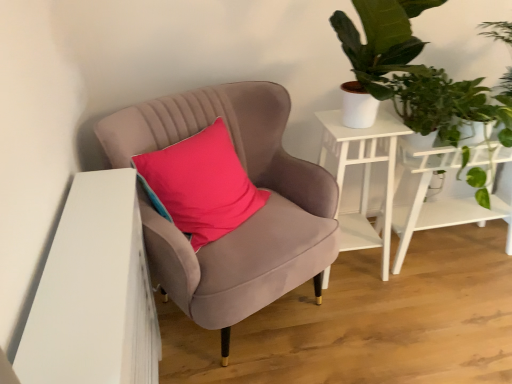
Question: Is white wood side table at upper right, the second table viewed from the right, turned away from green leafy plant at upper right?

Choices:
 (A) no
 (B) yes

Answer: (A)

Question: Considering the relative positions of white wood side table at upper right, arranged as the 1th table when viewed from the left, and green leafy plant at upper right in the image provided, is white wood side table at upper right, arranged as the 1th table when viewed from the left, behind green leafy plant at upper right?

Choices:
 (A) no
 (B) yes

Answer: (B)

Question: From a real-world perspective, is white wood side table at upper right, arranged as the 1th table when viewed from the left, below green leafy plant at upper right?

Choices:
 (A) no
 (B) yes

Answer: (B)

Question: Can you confirm if white wood side table at upper right, the second table viewed from the right, is positioned to the right of green leafy plant at upper right?

Choices:
 (A) no
 (B) yes

Answer: (A)

Question: Can you confirm if white wood side table at upper right, arranged as the 1th table when viewed from the left, is smaller than green leafy plant at upper right?

Choices:
 (A) yes
 (B) no

Answer: (B)

Question: Is velvet pink chair at center to the left or to the right of white matte table at right, positioned as the second table in left-to-right order, in the image?

Choices:
 (A) right
 (B) left

Answer: (B)

Question: From a real-world perspective, is velvet pink chair at center physically located above or below white matte table at right, positioned as the second table in left-to-right order?

Choices:
 (A) below
 (B) above

Answer: (B)

Question: Is velvet pink chair at center in front of or behind white matte table at right, positioned as the second table in left-to-right order, in the image?

Choices:
 (A) behind
 (B) front

Answer: (B)

Question: Considering the positions of velvet pink chair at center and white matte table at right, positioned as the second table in left-to-right order, in the image, is velvet pink chair at center wider or thinner than white matte table at right, positioned as the second table in left-to-right order,?

Choices:
 (A) wide
 (B) thin

Answer: (A)

Question: From the image's perspective, is velvet pink chair at center located above or below green leafy plant at upper right?

Choices:
 (A) above
 (B) below

Answer: (B)

Question: In terms of width, does velvet pink chair at center look wider or thinner when compared to green leafy plant at upper right?

Choices:
 (A) thin
 (B) wide

Answer: (B)

Question: Is velvet pink chair at center inside the boundaries of green leafy plant at upper right, or outside?

Choices:
 (A) inside
 (B) outside

Answer: (B)

Question: In terms of height, does velvet pink chair at center look taller or shorter compared to green leafy plant at upper right?

Choices:
 (A) short
 (B) tall

Answer: (B)

Question: Is point (446, 130) closer or farther from the camera than point (219, 193)?

Choices:
 (A) farther
 (B) closer

Answer: (A)

Question: In the image, is green leafy plant at upper right positioned in front of or behind velvet pink pillow at center?

Choices:
 (A) front
 (B) behind

Answer: (B)